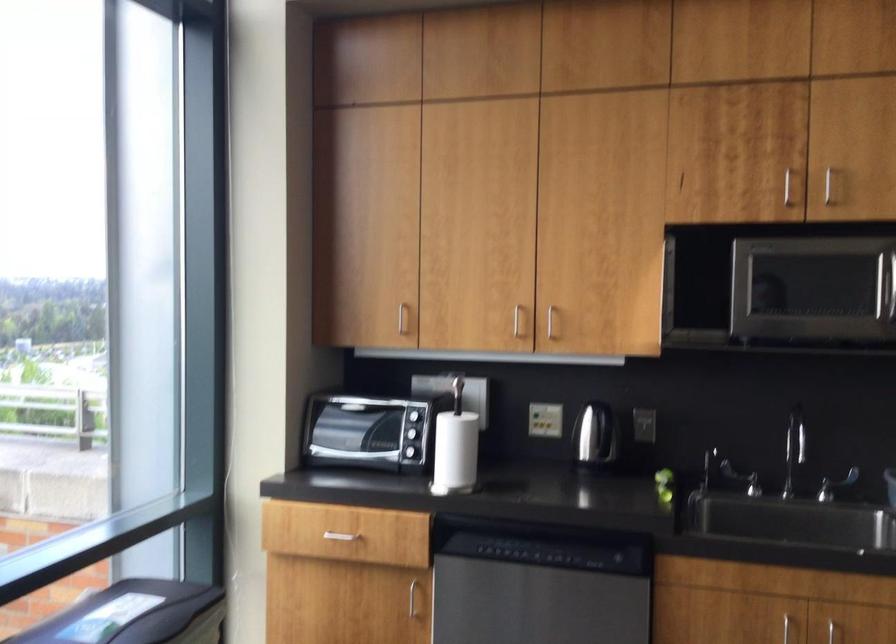
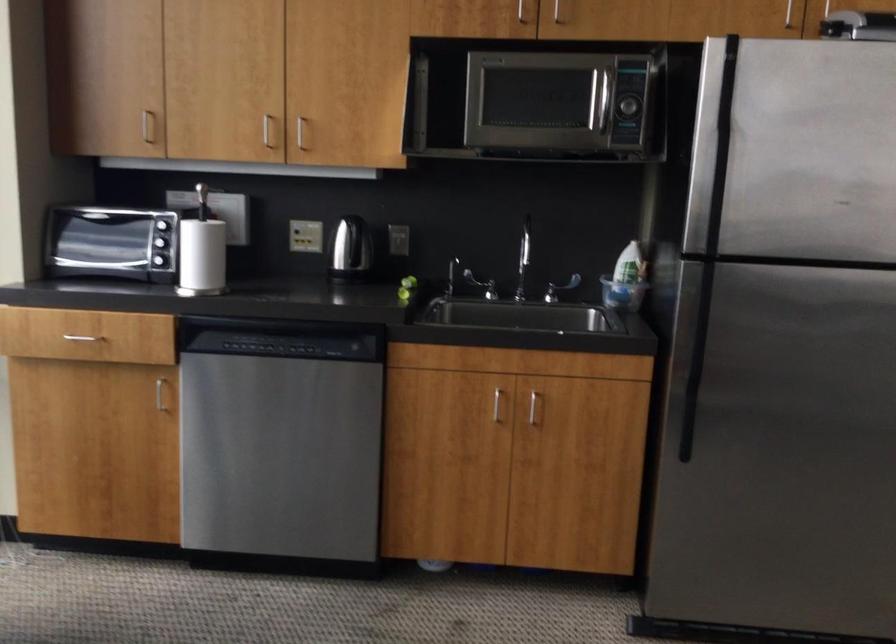
Find the pixel in the second image that matches pixel 452 480 in the first image.

(202, 281)